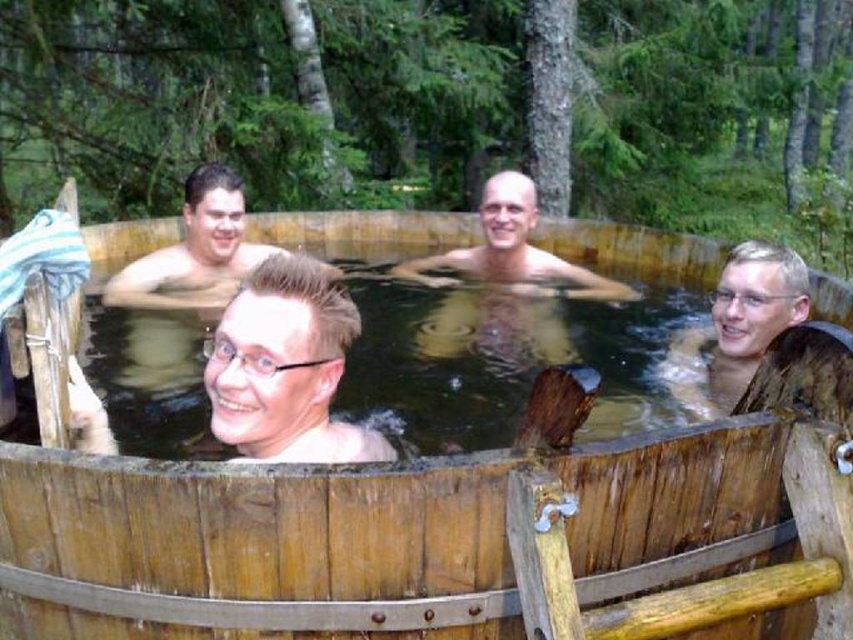
Question: Which object is positioned closest to the matte skin at center?

Choices:
 (A) clear plastic glasses at center
 (B) wooden hot tub at center

Answer: (A)

Question: Which point appears farthest from the camera in this image?

Choices:
 (A) (314, 324)
 (B) (9, 545)
 (C) (526, 177)

Answer: (C)

Question: Which point is closer to the camera?

Choices:
 (A) (675, 346)
 (B) (303, 440)
 (C) (457, 252)

Answer: (B)

Question: Considering the relative positions of matte skin at center and smooth skin man at center in the image provided, where is matte skin at center located with respect to smooth skin man at center?

Choices:
 (A) above
 (B) below

Answer: (A)

Question: Does wooden hot tub at center have a smaller size compared to matte skin at center?

Choices:
 (A) no
 (B) yes

Answer: (A)

Question: Is matte skin at center bigger than smooth skin man at center?

Choices:
 (A) yes
 (B) no

Answer: (B)